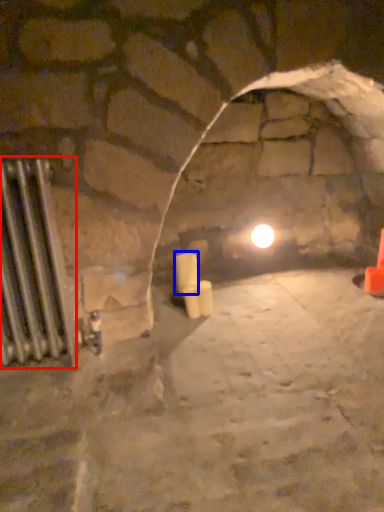
Question: Which point is closer to the camera, radiator (highlighted by a red box) or candle (highlighted by a blue box)?

Choices:
 (A) radiator
 (B) candle

Answer: (A)